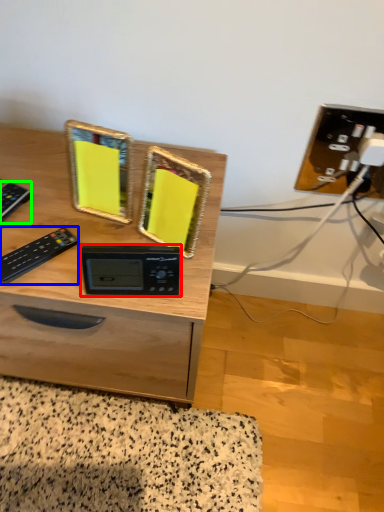
Question: Which is nearer to the appliance (highlighted by a red box)? control (highlighted by a blue box) or control (highlighted by a green box).

Choices:
 (A) control
 (B) control

Answer: (A)